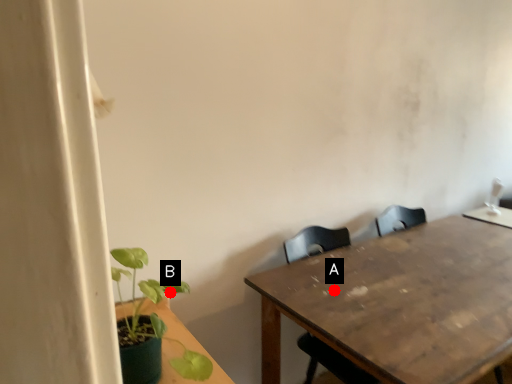
Question: Two points are circled on the image, labeled by A and B beside each circle. Which point is closer to the camera taking this photo?

Choices:
 (A) A is closer
 (B) B is closer

Answer: (B)